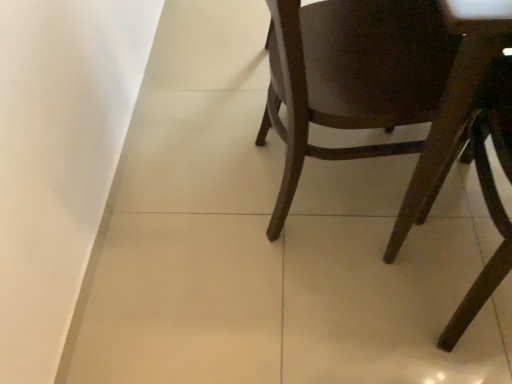
Where is `free space that is to the left of dark wood chair at right, acting as the second chair starting from the right`? The width and height of the screenshot is (512, 384). free space that is to the left of dark wood chair at right, acting as the second chair starting from the right is located at coordinates (203, 199).